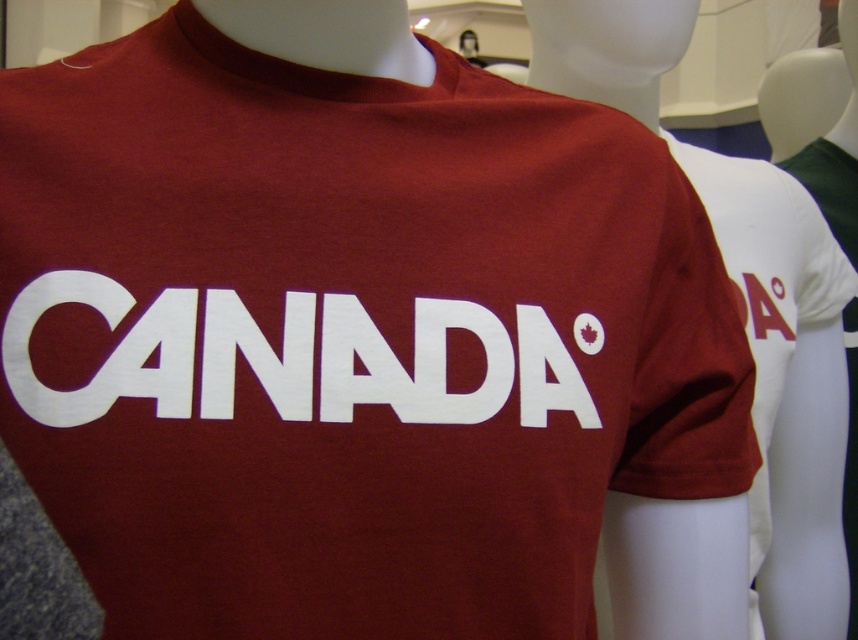
Question: Which object appears closest to the camera in this image?

Choices:
 (A) white matte text at center
 (B) maroon t-shirt at center

Answer: (A)

Question: Can you confirm if maroon t-shirt at center is bigger than matte red maple leaf at center?

Choices:
 (A) no
 (B) yes

Answer: (B)

Question: Which point is closer to the camera?

Choices:
 (A) (807, 380)
 (B) (101, 310)

Answer: (B)

Question: Which object is the closest to the white matte text at center?

Choices:
 (A) maroon t-shirt at center
 (B) matte red maple leaf at center

Answer: (B)

Question: Does white matte text at center appear under matte red maple leaf at center?

Choices:
 (A) no
 (B) yes

Answer: (B)

Question: Considering the relative positions of maroon t-shirt at center and white matte text at center in the image provided, where is maroon t-shirt at center located with respect to white matte text at center?

Choices:
 (A) below
 (B) above

Answer: (B)